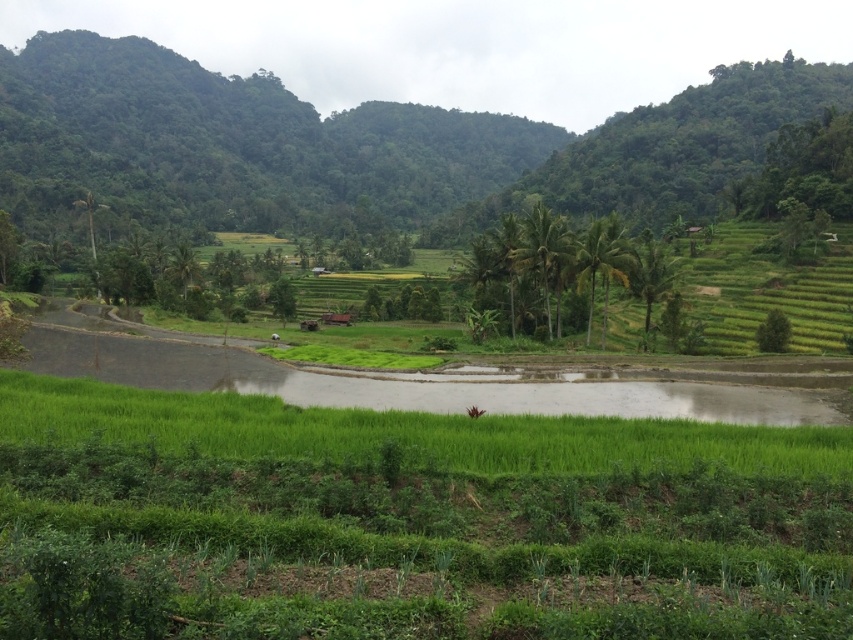
Does green grassy rice field at center have a greater height compared to green leafy mountain at center?

No.

What are the coordinates of `green grassy rice field at center` in the screenshot? It's located at (428, 518).